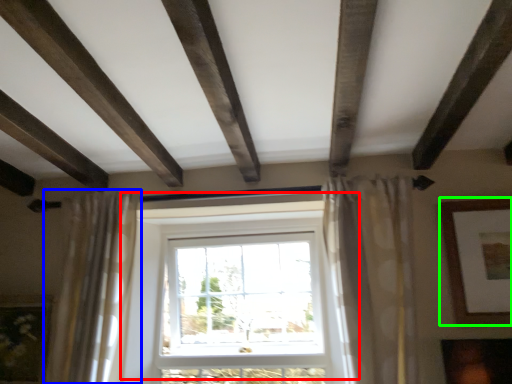
Question: Based on their relative distances, which object is nearer to window (highlighted by a red box)? Choose from curtain (highlighted by a blue box) and picture frame (highlighted by a green box).

Choices:
 (A) curtain
 (B) picture frame

Answer: (A)